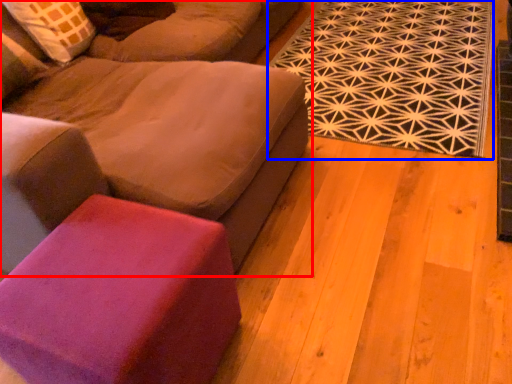
Question: Among these objects, which one is nearest to the camera, studio couch (highlighted by a red box) or mat (highlighted by a blue box)?

Choices:
 (A) studio couch
 (B) mat

Answer: (A)